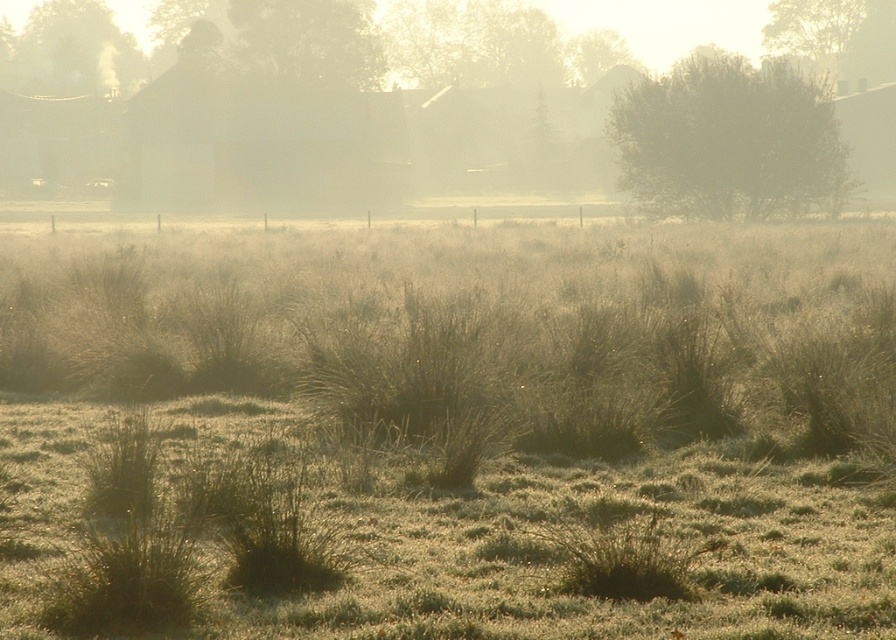
You are an artist sketching this landscape and want to ensure proper perspective. Which object, the green leafy bush at upper right or the green grass at upper left, should you draw as being closer to the viewer based on their heights in the image?

The green leafy bush at upper right should be drawn closer to the viewer because it has a lesser height compared to the green grass at upper left, indicating it is nearer in the scene.

You are standing in the misty landscape and want to take a photo of the green leafy tree at upper center. To ensure it is centered in your viewfinder, where should you aim your camera? Please provide coordinates based on the image grid system where the bottom left corner is 0,0 and the top right corner is 1,1.

The green leafy tree at upper center is located at coordinates (309, 42), so you should aim your camera at those coordinates to center it in the viewfinder.

Based on the photo, you are an artist setting up your easel to paint the landscape. You want to capture the green leafy bush at upper right and the green leafy tree at upper center in your painting. Which of these two objects should you position higher on your canvas to accurately represent their sizes as seen in the scene?

The green leafy bush at upper right should be positioned higher on the canvas because it has a greater height compared to the green leafy tree at upper center.